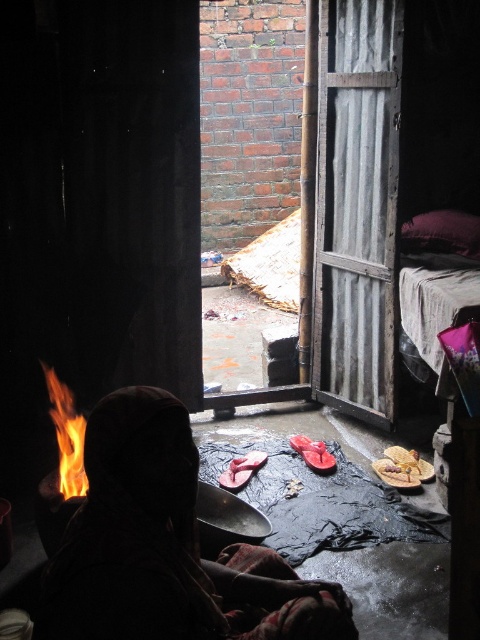
You are standing in the room and want to place a small candle between the two points, point (96, 477) and point (58, 396). To ensure it is visible from where you are standing, which point should you place it closer to?

You should place the candle closer to point (96, 477) because it is closer to you than point (58, 396), making it more visible from your current position.

You are a visitor in this dimly lit space. You notice the silhouette fabric at center and the flameflame at center. Which object is positioned lower in the scene?

The silhouette fabric at center is positioned lower than the flameflame at center in the scene.